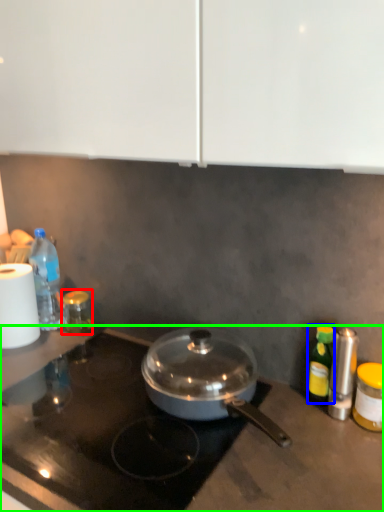
Question: Estimate the real-world distances between objects in this image. Which object is farther from bottle (highlighted by a red box), bottle (highlighted by a blue box) or gas stove (highlighted by a green box)?

Choices:
 (A) bottle
 (B) gas stove

Answer: (A)